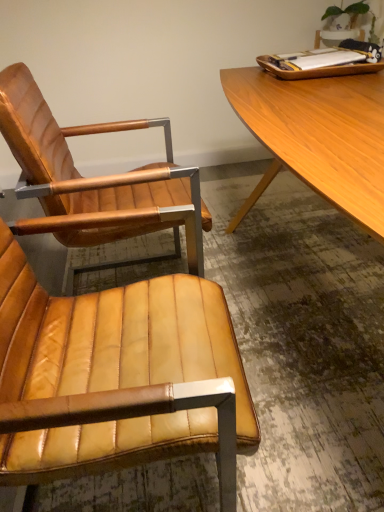
Question: Is leather chair at center, which appears as the second chair when viewed from the back, wider or thinner than leather chair at center, which appears as the second chair when viewed from the front?

Choices:
 (A) wide
 (B) thin

Answer: (B)

Question: Is point (97, 434) closer or farther from the camera than point (114, 208)?

Choices:
 (A) farther
 (B) closer

Answer: (B)

Question: From a real-world perspective, is leather chair at center, which ranks as the first chair in front-to-back order, positioned above or below leather chair at center, which appears as the second chair when viewed from the front?

Choices:
 (A) above
 (B) below

Answer: (B)

Question: Would you say leather chair at center, which appears as the second chair when viewed from the front, is to the left or to the right of leather chair at center, which appears as the second chair when viewed from the back, in the picture?

Choices:
 (A) left
 (B) right

Answer: (A)

Question: From the image's perspective, is leather chair at center, the first chair from the back, above or below leather chair at center, which ranks as the first chair in front-to-back order?

Choices:
 (A) above
 (B) below

Answer: (A)

Question: From a real-world perspective, is leather chair at center, the first chair from the back, positioned above or below leather chair at center, which ranks as the first chair in front-to-back order?

Choices:
 (A) below
 (B) above

Answer: (B)

Question: In the image, is leather chair at center, the first chair from the back, positioned in front of or behind leather chair at center, which ranks as the first chair in front-to-back order?

Choices:
 (A) behind
 (B) front

Answer: (A)